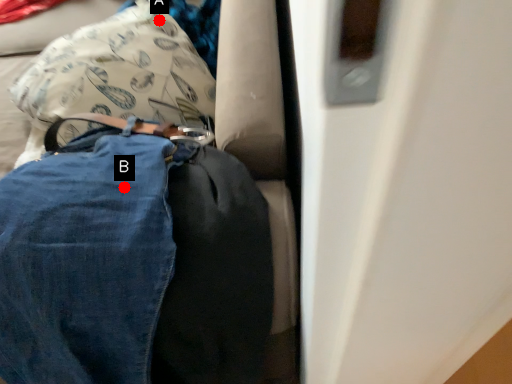
Question: Two points are circled on the image, labeled by A and B beside each circle. Which point is closer to the camera taking this photo?

Choices:
 (A) A is closer
 (B) B is closer

Answer: (B)